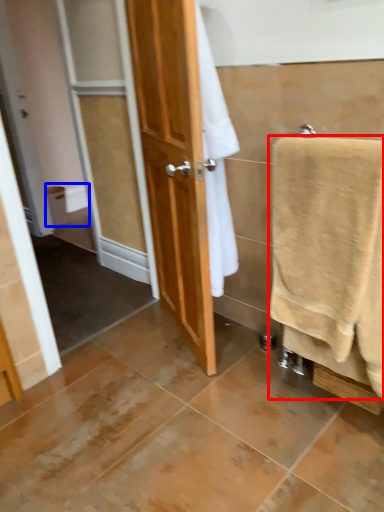
Question: Which point is closer to the camera, towel (highlighted by a red box) or toilet paper (highlighted by a blue box)?

Choices:
 (A) towel
 (B) toilet paper

Answer: (A)